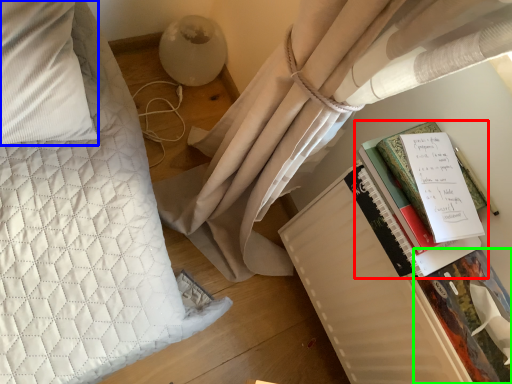
Question: Which is nearer to the book (highlighted by a red box)? pillow (highlighted by a blue box) or paperback book (highlighted by a green box).

Choices:
 (A) pillow
 (B) paperback book

Answer: (B)